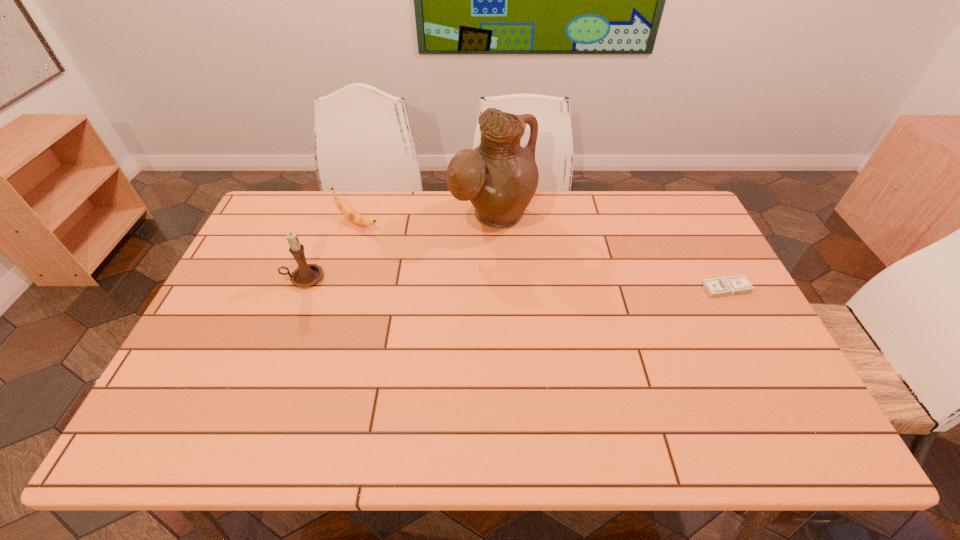
Image resolution: width=960 pixels, height=540 pixels. I want to click on empty space that is in between the third object from left to right and the second shortest object, so click(x=425, y=220).

Identify the location of blank region between the second shortest object and the rightmost object. (541, 255).

Find the location of a particular element. vacant area between the shortest object and the tallest object is located at coordinates (610, 253).

This screenshot has height=540, width=960. Find the location of `vacant area that lies between the rightmost object and the second shortest object`. vacant area that lies between the rightmost object and the second shortest object is located at coordinates (541, 255).

This screenshot has height=540, width=960. What are the coordinates of `free area in between the banana and the candle holder` in the screenshot? It's located at (330, 251).

I want to click on vacant area between the pitcher and the candle holder, so tap(398, 248).

The width and height of the screenshot is (960, 540). What are the coordinates of `free space between the shortest object and the third shortest object` in the screenshot? It's located at (516, 283).

Select which object is the third closest to the money. Please provide its 2D coordinates. Your answer should be formatted as a tuple, i.e. [(x, y)], where the tuple contains the x and y coordinates of a point satisfying the conditions above.

[(305, 275)]

Select which object appears as the second closest to the third shortest object. Please provide its 2D coordinates. Your answer should be formatted as a tuple, i.e. [(x, y)], where the tuple contains the x and y coordinates of a point satisfying the conditions above.

[(499, 177)]

At what (x,y) coordinates should I click in order to perform the action: click on blank area in the image that satisfies the following two spatial constraints: 1. on the back side of the banana; 2. on the left side of the second object from right to left. Please return your answer as a coordinate pair (x, y). This screenshot has height=540, width=960. Looking at the image, I should click on (359, 218).